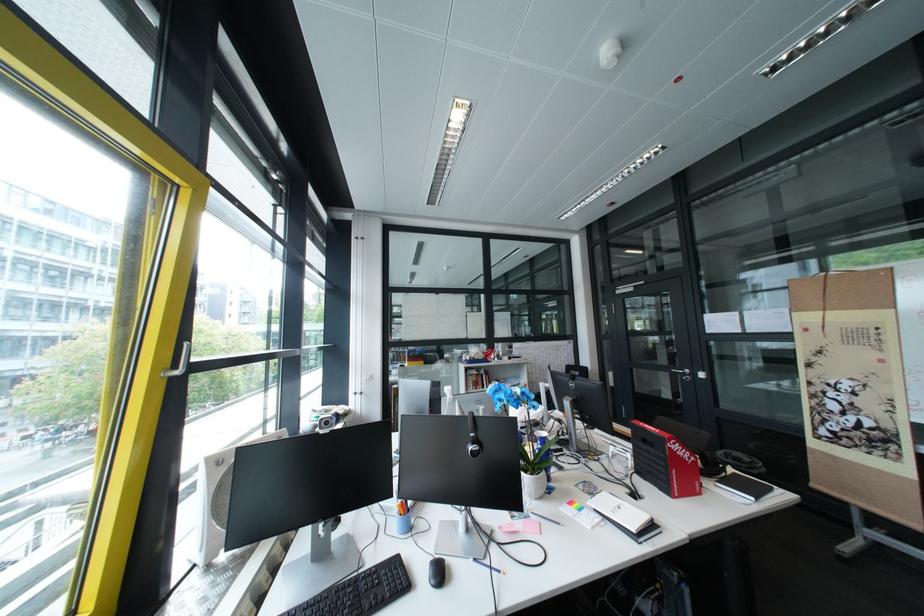
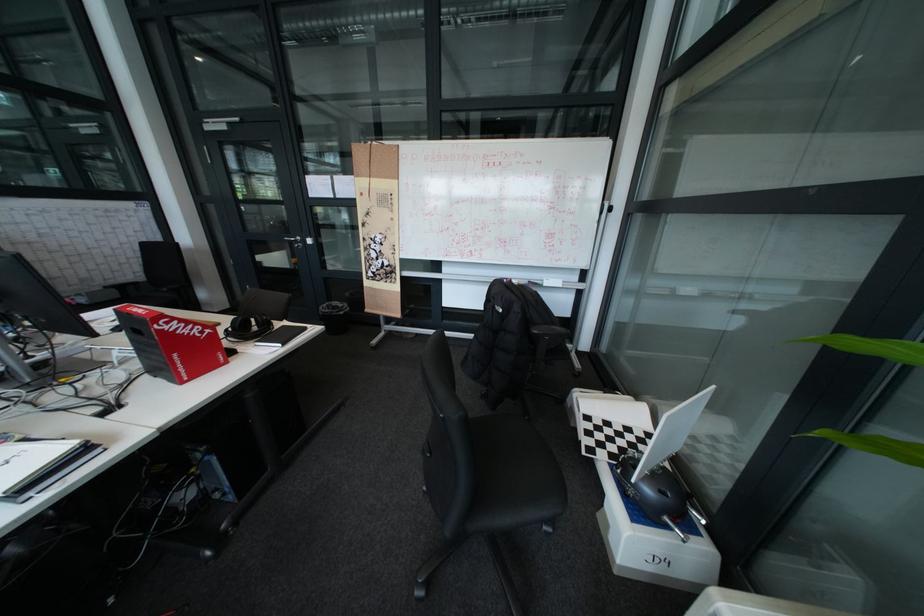
In the second image, find the point that corresponds to pixel 666 525 in the first image.

(99, 452)